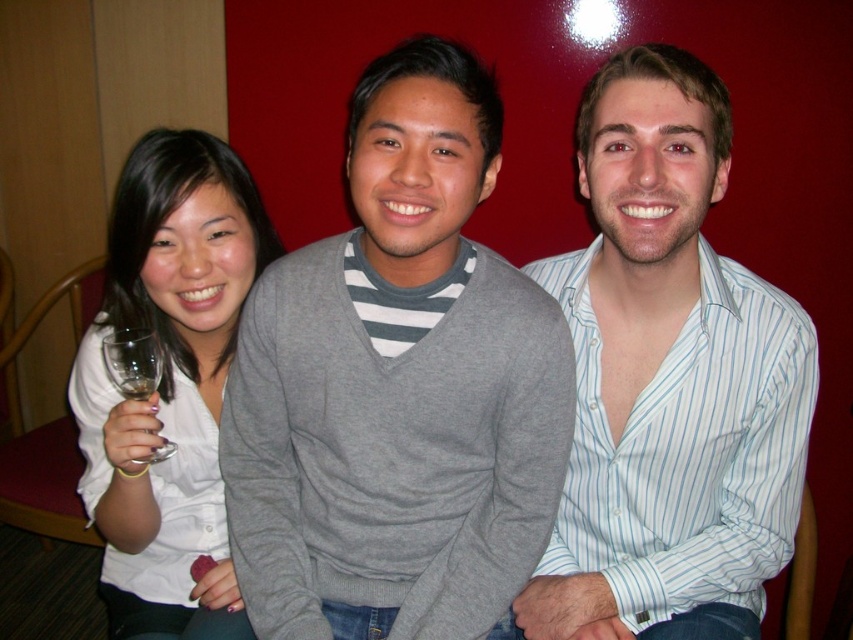
Does point (163, 324) come farther from viewer compared to point (113, 381)?

Yes, it is behind point (113, 381).

Does white matte shirt at left have a smaller size compared to clear glass wine glass at lower left?

No.

Find the location of a particular element. white matte shirt at left is located at coordinates (169, 384).

Locate an element on the screen. white matte shirt at left is located at coordinates (169, 384).

Can you confirm if gray sweater at center is shorter than white striped shirt at center?

Yes.

Consider the image. Is gray sweater at center closer to camera compared to white striped shirt at center?

Yes, gray sweater at center is closer to the viewer.

Between point (329, 598) and point (640, 518), which one is positioned behind?

The point (640, 518) is behind.

Locate an element on the screen. The width and height of the screenshot is (853, 640). gray sweater at center is located at coordinates (397, 387).

From the picture: Between gray sweater at center and white matte shirt at left, which one has less height?

With less height is gray sweater at center.

Does point (463, 291) come behind point (173, 148)?

No.

Locate an element on the screen. The width and height of the screenshot is (853, 640). gray sweater at center is located at coordinates (397, 387).